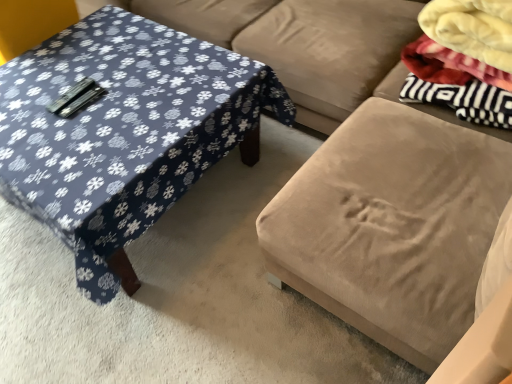
Question: Which is correct: blue fabric-covered table at left is inside fluffy white blanket at upper right, or outside of it?

Choices:
 (A) outside
 (B) inside

Answer: (A)

Question: From the image's perspective, is blue fabric-covered table at left above or below fluffy white blanket at upper right?

Choices:
 (A) above
 (B) below

Answer: (B)

Question: Considering the real-world distances, which object is closest to the velvet beige ottoman at center?

Choices:
 (A) blue fabric-covered table at left
 (B) suede couch at center
 (C) fluffy white blanket at upper right

Answer: (C)

Question: Which object is the closest to the suede couch at center?

Choices:
 (A) blue fabric-covered table at left
 (B) velvet beige ottoman at center
 (C) fluffy white blanket at upper right

Answer: (C)